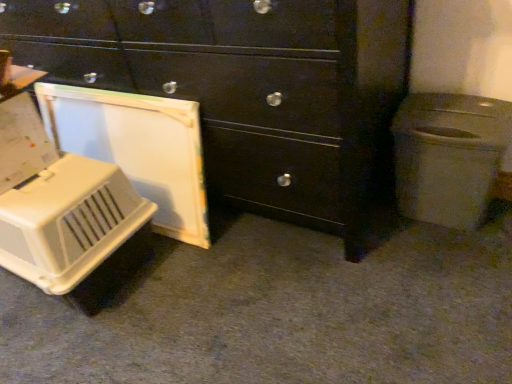
Question: Is matte black chest of drawers at center beside white plastic trash can at right?

Choices:
 (A) yes
 (B) no

Answer: (B)

Question: Is matte black chest of drawers at center facing away from white plastic trash can at right?

Choices:
 (A) no
 (B) yes

Answer: (A)

Question: From the image's perspective, is matte black chest of drawers at center on top of white plastic trash can at right?

Choices:
 (A) no
 (B) yes

Answer: (B)

Question: Considering the relative sizes of matte black chest of drawers at center and white plastic trash can at right in the image provided, is matte black chest of drawers at center taller than white plastic trash can at right?

Choices:
 (A) yes
 (B) no

Answer: (A)

Question: Does matte black chest of drawers at center have a larger size compared to white plastic trash can at right?

Choices:
 (A) no
 (B) yes

Answer: (B)

Question: Can you confirm if matte black chest of drawers at center is wider than white plastic trash can at right?

Choices:
 (A) no
 (B) yes

Answer: (B)

Question: Is white plastic pet carrier at left surrounding white plastic pet carrier at lower left?

Choices:
 (A) no
 (B) yes

Answer: (A)

Question: Does white plastic pet carrier at left appear on the right side of white plastic pet carrier at lower left?

Choices:
 (A) yes
 (B) no

Answer: (A)

Question: From a real-world perspective, is white plastic pet carrier at left physically above white plastic pet carrier at lower left?

Choices:
 (A) yes
 (B) no

Answer: (B)

Question: Can you confirm if white plastic pet carrier at left is smaller than white plastic pet carrier at lower left?

Choices:
 (A) yes
 (B) no

Answer: (B)

Question: Would you consider white plastic pet carrier at left to be distant from white plastic pet carrier at lower left?

Choices:
 (A) no
 (B) yes

Answer: (A)

Question: Is white plastic pet carrier at left oriented towards white plastic pet carrier at lower left?

Choices:
 (A) yes
 (B) no

Answer: (B)

Question: Is white plastic trash can at right thinner than white plastic pet carrier at lower left?

Choices:
 (A) yes
 (B) no

Answer: (A)